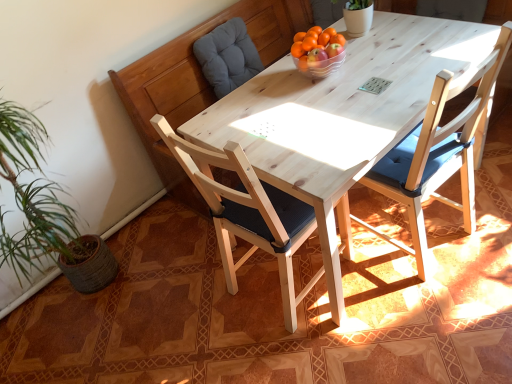
Question: Can you confirm if light wood chair at center, the 2th chair viewed from the left, is shorter than natural wood chair at center, which is the second chair in right-to-left order?

Choices:
 (A) no
 (B) yes

Answer: (B)

Question: Considering the relative sizes of light wood chair at center, the 2th chair viewed from the left, and natural wood chair at center, which is the second chair in right-to-left order, in the image provided, is light wood chair at center, the 2th chair viewed from the left, bigger than natural wood chair at center, which is the second chair in right-to-left order,?

Choices:
 (A) no
 (B) yes

Answer: (B)

Question: Does light wood chair at center, the 2th chair viewed from the left, have a smaller size compared to natural wood chair at center, which is the second chair in right-to-left order?

Choices:
 (A) no
 (B) yes

Answer: (A)

Question: Is light wood chair at center, the 2th chair viewed from the left, positioned with its back to natural wood chair at center, which is the second chair in right-to-left order?

Choices:
 (A) no
 (B) yes

Answer: (A)

Question: Is the position of light wood chair at center, the 2th chair viewed from the left, more distant than that of natural wood chair at center, which is the 1th chair from left to right?

Choices:
 (A) yes
 (B) no

Answer: (A)

Question: From the image's perspective, is light wood chair at center, the 2th chair viewed from the left, below natural wood chair at center, which is the 1th chair from left to right?

Choices:
 (A) no
 (B) yes

Answer: (A)

Question: Is natural wood chair at center, which is the 1th chair from left to right, to the left of translucent glass bowl at center from the viewer's perspective?

Choices:
 (A) no
 (B) yes

Answer: (B)

Question: Is natural wood chair at center, which is the second chair in right-to-left order, further to the viewer compared to translucent glass bowl at center?

Choices:
 (A) no
 (B) yes

Answer: (A)

Question: Can you confirm if natural wood chair at center, which is the second chair in right-to-left order, is shorter than translucent glass bowl at center?

Choices:
 (A) no
 (B) yes

Answer: (A)

Question: Is the depth of natural wood chair at center, which is the 1th chair from left to right, less than that of translucent glass bowl at center?

Choices:
 (A) no
 (B) yes

Answer: (B)

Question: From a real-world perspective, is natural wood chair at center, which is the second chair in right-to-left order, positioned under translucent glass bowl at center based on gravity?

Choices:
 (A) yes
 (B) no

Answer: (A)

Question: Can you confirm if natural wood chair at center, which is the 1th chair from left to right, is taller than translucent glass bowl at center?

Choices:
 (A) no
 (B) yes

Answer: (B)

Question: Would you say light wood chair at center, which is the first chair in right-to-left order, contains gray fabric cushion at upper left?

Choices:
 (A) yes
 (B) no

Answer: (B)